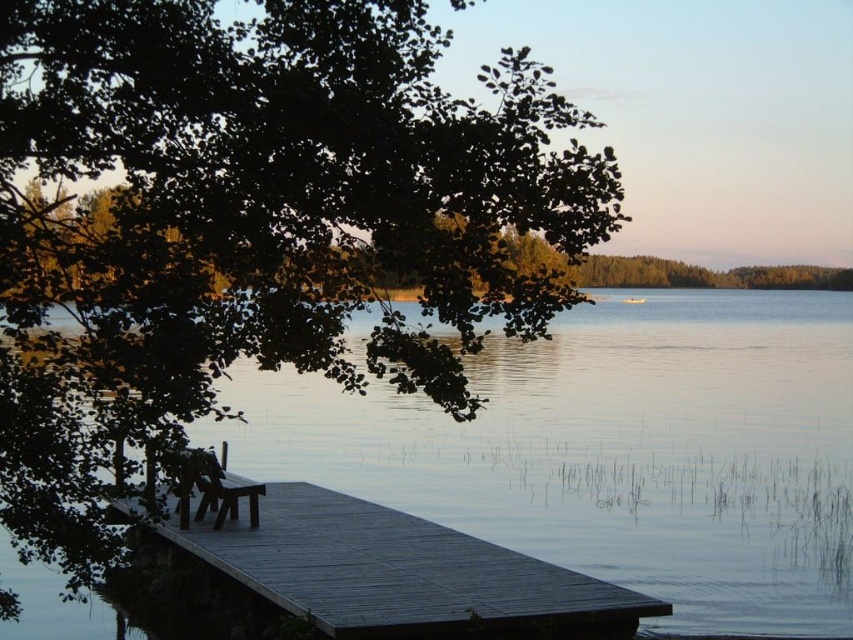
Question: Does green leafy tree at upper left lie behind wooden bench at lower left?

Choices:
 (A) yes
 (B) no

Answer: (B)

Question: Does transparent water at center lie behind wooden bench at lower left?

Choices:
 (A) yes
 (B) no

Answer: (B)

Question: Which point appears farthest from the camera in this image?

Choices:
 (A) (210, 468)
 (B) (239, 164)

Answer: (A)

Question: Based on their relative distances, which object is farther from the wooden bench at lower left?

Choices:
 (A) dark wood dock at lower left
 (B) transparent water at center

Answer: (B)

Question: Which is farther from the wooden bench at lower left?

Choices:
 (A) green leafy tree at upper left
 (B) dark wood dock at lower left

Answer: (A)

Question: Can you confirm if transparent water at center is smaller than wooden bench at lower left?

Choices:
 (A) no
 (B) yes

Answer: (A)